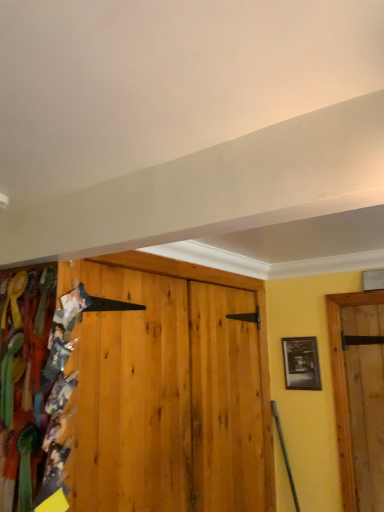
Question: From a real-world perspective, is black glossy picture frame at right beneath multicolored fabric at left?

Choices:
 (A) no
 (B) yes

Answer: (A)

Question: Is black glossy picture frame at right far from multicolored fabric at left?

Choices:
 (A) no
 (B) yes

Answer: (B)

Question: Can you see black glossy picture frame at right touching multicolored fabric at left?

Choices:
 (A) no
 (B) yes

Answer: (A)

Question: Considering the relative positions of black glossy picture frame at right and multicolored fabric at left in the image provided, is black glossy picture frame at right behind multicolored fabric at left?

Choices:
 (A) yes
 (B) no

Answer: (A)

Question: Does black glossy picture frame at right have a greater height compared to multicolored fabric at left?

Choices:
 (A) no
 (B) yes

Answer: (A)

Question: Considering the relative sizes of black glossy picture frame at right and multicolored fabric at left in the image provided, is black glossy picture frame at right wider than multicolored fabric at left?

Choices:
 (A) yes
 (B) no

Answer: (B)

Question: Does multicolored fabric at left have a lesser width compared to black glossy picture frame at right?

Choices:
 (A) yes
 (B) no

Answer: (B)

Question: Is multicolored fabric at left wider than black glossy picture frame at right?

Choices:
 (A) no
 (B) yes

Answer: (B)

Question: Does multicolored fabric at left lie behind black glossy picture frame at right?

Choices:
 (A) yes
 (B) no

Answer: (B)

Question: Is multicolored fabric at left beside black glossy picture frame at right?

Choices:
 (A) yes
 (B) no

Answer: (B)

Question: Considering the relative sizes of multicolored fabric at left and black glossy picture frame at right in the image provided, is multicolored fabric at left bigger than black glossy picture frame at right?

Choices:
 (A) no
 (B) yes

Answer: (B)

Question: Considering the relative positions of multicolored fabric at left and black glossy picture frame at right in the image provided, is multicolored fabric at left to the right of black glossy picture frame at right from the viewer's perspective?

Choices:
 (A) no
 (B) yes

Answer: (A)

Question: Is black glossy picture frame at right bigger or smaller than multicolored fabric at left?

Choices:
 (A) small
 (B) big

Answer: (A)